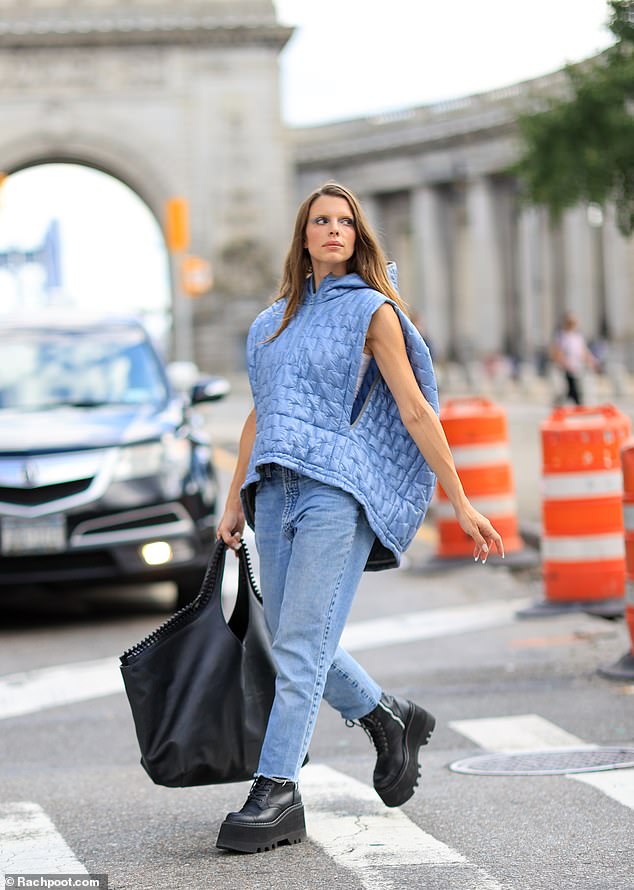
The height and width of the screenshot is (890, 634). Find the location of `handle`. handle is located at coordinates (219, 553).